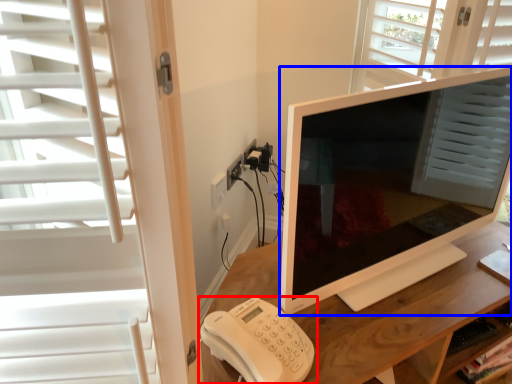
Question: Among these objects, which one is farthest to the camera, corded phone (highlighted by a red box) or television (highlighted by a blue box)?

Choices:
 (A) corded phone
 (B) television

Answer: (A)